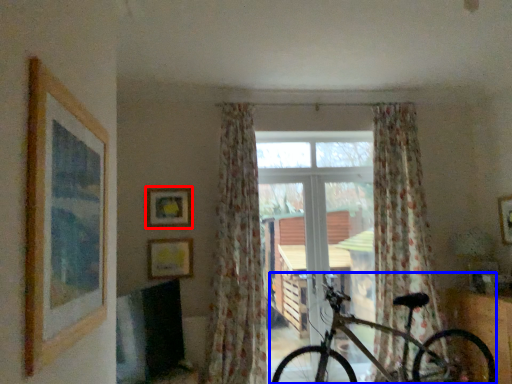
Question: Which of the following is the farthest to the observer, picture frame (highlighted by a red box) or bicycle (highlighted by a blue box)?

Choices:
 (A) picture frame
 (B) bicycle

Answer: (A)